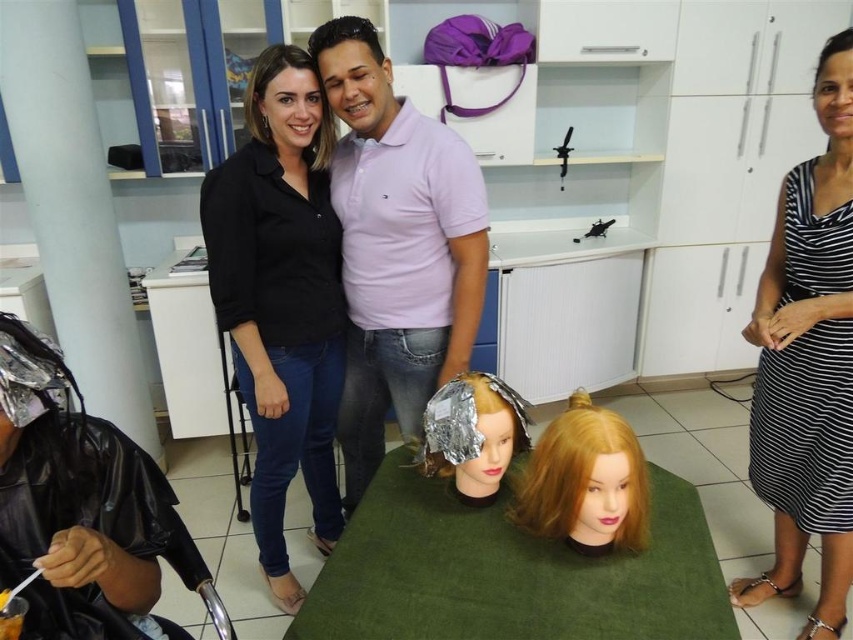
You are a customer who wants to know if the purple cotton polo shirt at center is within easy reach of the shiny gold foil at center. The minimum distance required for easy reach is 50 centimeters. Can you confirm if it meets this requirement?

The purple cotton polo shirt at center is 51.41 centimeters from the shiny gold foil at center, which exceeds the minimum distance of 50 centimeters required for easy reach. Therefore, it is within easy reach.

You are a trainee hairdresser in a studio. You need to move from the entrance to the green table where the two mannequin heads are placed. The entrance is located to the left of the white cabinets. Which direction should you walk to reach the green table first, passing by the matte black hair at upper center before the dark brown shiny hair at upper right?

Since the matte black hair at upper center is positioned on the left side of dark brown shiny hair at upper right, you should walk towards the left side of the dark brown shiny hair at upper right to reach the green table first while passing by the matte black hair at upper center before the dark brown shiny hair at upper right.